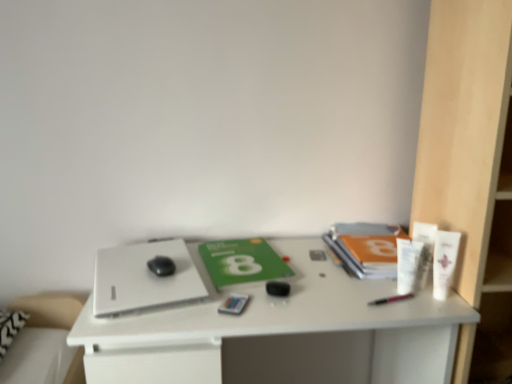
The width and height of the screenshot is (512, 384). In order to click on free space in front of black matte mouse at center in this screenshot , I will do `click(144, 290)`.